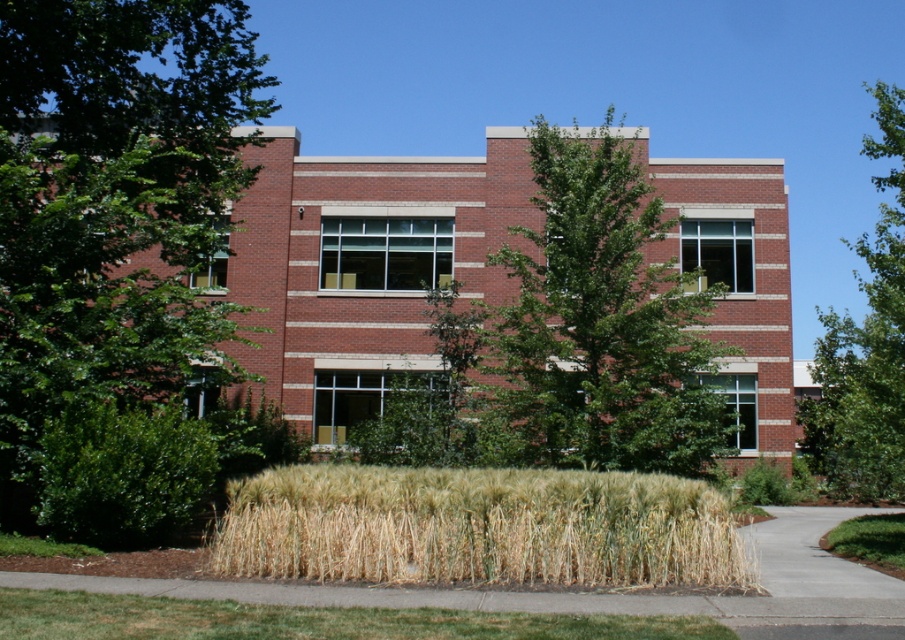
Question: Which is nearer to the green leafy tree at left?

Choices:
 (A) green leafy tree at upper right
 (B) green leafy grass at lower right
 (C) green leafy tree at center

Answer: (C)

Question: Can you confirm if green grass at lower center is smaller than green leafy tree at upper right?

Choices:
 (A) yes
 (B) no

Answer: (A)

Question: In this image, where is green leafy tree at center located relative to green leafy tree at upper right?

Choices:
 (A) right
 (B) left

Answer: (B)

Question: Which object is closer to the camera taking this photo?

Choices:
 (A) dry straw at lower center
 (B) green grass at lower center
 (C) green leafy tree at upper right

Answer: (B)

Question: Which point is farther to the camera?

Choices:
 (A) dry straw at lower center
 (B) green leafy tree at center
 (C) green grass at lower center
 (D) green leafy grass at lower right

Answer: (B)

Question: Is green leafy tree at left to the right of green leafy grass at lower right from the viewer's perspective?

Choices:
 (A) no
 (B) yes

Answer: (A)